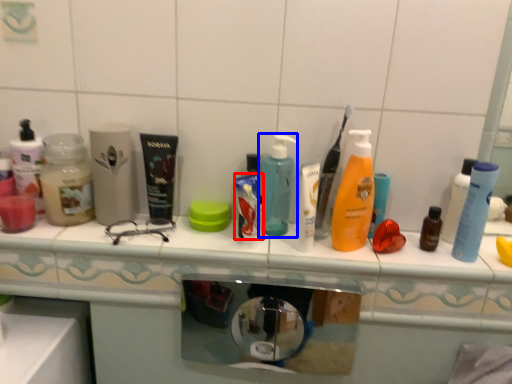
Question: Which object is further to the camera taking this photo, toothpaste (highlighted by a red box) or bottle (highlighted by a blue box)?

Choices:
 (A) toothpaste
 (B) bottle

Answer: (B)